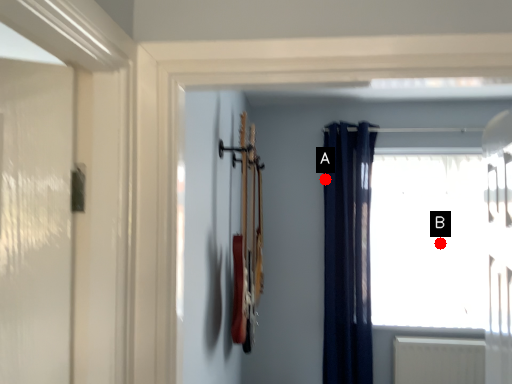
Question: Two points are circled on the image, labeled by A and B beside each circle. Which point is closer to the camera?

Choices:
 (A) A is closer
 (B) B is closer

Answer: (A)